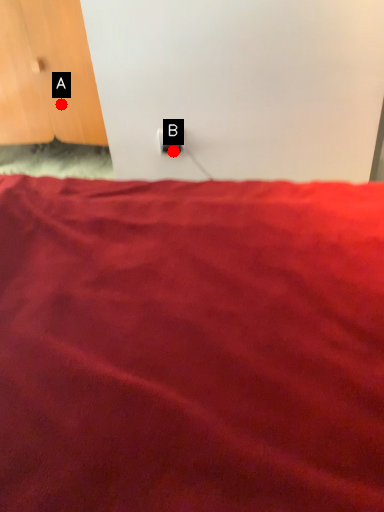
Question: Two points are circled on the image, labeled by A and B beside each circle. Which point is farther to the camera?

Choices:
 (A) A is further
 (B) B is further

Answer: (A)